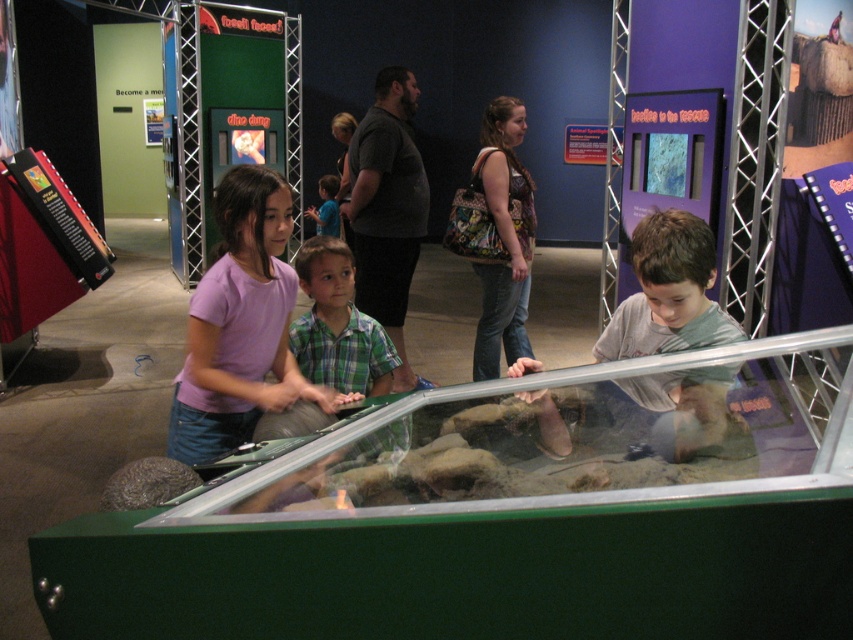
Question: Which object appears farthest from the camera in this image?

Choices:
 (A) green matte glass box at center
 (B) gray matte shirt at center

Answer: (B)

Question: Is green matte glass box at center above pink cotton shirt at center?

Choices:
 (A) yes
 (B) no

Answer: (B)

Question: Which point appears farthest from the camera in this image?

Choices:
 (A) (337, 182)
 (B) (679, 406)
 (C) (254, 378)
 (D) (763, 592)

Answer: (A)

Question: Can you confirm if pink cotton shirt at center is bigger than gray matte shirt at center?

Choices:
 (A) no
 (B) yes

Answer: (B)

Question: Estimate the real-world distances between objects in this image. Which object is farther from the pink cotton shirt at center?

Choices:
 (A) green plaid shirt at center
 (B) gray matte shirt at center
 (C) green matte glass box at center

Answer: (A)

Question: Is green matte glass box at center closer to the viewer compared to gray matte shirt at center?

Choices:
 (A) no
 (B) yes

Answer: (B)